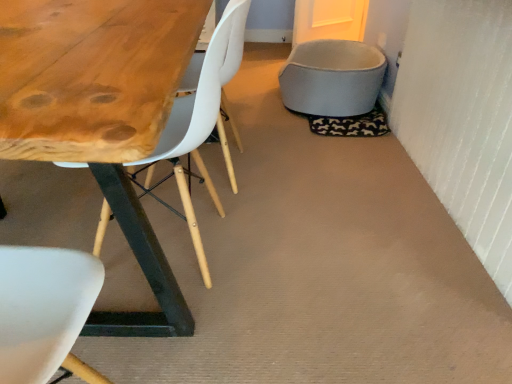
Question: Is white plastic chair at upper left at the back of soft fabric pet bed at upper right?

Choices:
 (A) yes
 (B) no

Answer: (B)

Question: Is white plastic chair at upper left completely or partially inside soft fabric pet bed at upper right?

Choices:
 (A) no
 (B) yes

Answer: (A)

Question: Can you confirm if soft fabric pet bed at upper right is taller than white plastic chair at upper left?

Choices:
 (A) no
 (B) yes

Answer: (A)

Question: Is soft fabric pet bed at upper right thinner than white plastic chair at upper left?

Choices:
 (A) yes
 (B) no

Answer: (B)

Question: Is soft fabric pet bed at upper right not within white plastic chair at upper left?

Choices:
 (A) no
 (B) yes

Answer: (B)

Question: Would you say soft fabric pet bed at upper right is to the left or to the right of white matte chair at center in the picture?

Choices:
 (A) left
 (B) right

Answer: (B)

Question: From a real-world perspective, is soft fabric pet bed at upper right physically located above or below white matte chair at center?

Choices:
 (A) below
 (B) above

Answer: (A)

Question: In terms of width, does soft fabric pet bed at upper right look wider or thinner when compared to white matte chair at center?

Choices:
 (A) wide
 (B) thin

Answer: (A)

Question: Is soft fabric pet bed at upper right taller or shorter than white matte chair at center?

Choices:
 (A) tall
 (B) short

Answer: (B)

Question: Is white plastic chair at upper left taller or shorter than soft fabric pet bed at upper right?

Choices:
 (A) short
 (B) tall

Answer: (B)

Question: In the image, is white plastic chair at upper left positioned in front of or behind soft fabric pet bed at upper right?

Choices:
 (A) front
 (B) behind

Answer: (A)

Question: Is point (212, 61) positioned closer to the camera than point (311, 102)?

Choices:
 (A) farther
 (B) closer

Answer: (B)

Question: Would you say white plastic chair at upper left is to the left or to the right of soft fabric pet bed at upper right in the picture?

Choices:
 (A) right
 (B) left

Answer: (B)

Question: From the image's perspective, is white matte chair at center above or below white plastic chair at upper left?

Choices:
 (A) above
 (B) below

Answer: (A)

Question: Considering their positions, is white matte chair at center located in front of or behind white plastic chair at upper left?

Choices:
 (A) behind
 (B) front

Answer: (A)